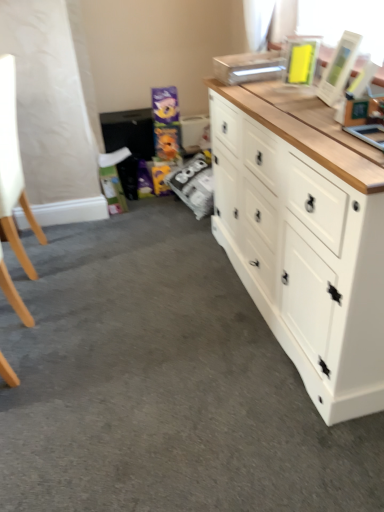
Describe the element at coordinates (304, 245) in the screenshot. The width and height of the screenshot is (384, 512). I see `white wood chest of drawers at right` at that location.

In order to face white wood chest of drawers at right, should I rotate leftwards or rightwards?

It's best to rotate right around 15.090 degrees.

Locate an element on the screen. white wood chest of drawers at right is located at coordinates (304, 245).

Describe the element at coordinates (13, 167) in the screenshot. I see `white leather swivel chair at left` at that location.

Locate an element on the screen. The image size is (384, 512). white leather swivel chair at left is located at coordinates (13, 167).

Find the location of a particular element. This screenshot has width=384, height=512. white wood chest of drawers at right is located at coordinates (304, 245).

Considering the relative positions of white wood chest of drawers at right and white leather swivel chair at left in the image provided, is white wood chest of drawers at right to the left of white leather swivel chair at left from the viewer's perspective?

Incorrect, white wood chest of drawers at right is not on the left side of white leather swivel chair at left.

Considering their positions, is white wood chest of drawers at right located in front of or behind white leather swivel chair at left?

white wood chest of drawers at right is in front of white leather swivel chair at left.

Does point (360, 234) lie behind point (10, 213)?

No, (360, 234) is closer to viewer.

From the image's perspective, between white wood chest of drawers at right and white leather swivel chair at left, which one is located above?

white leather swivel chair at left, from the image's perspective.

From a real-world perspective, is white wood chest of drawers at right above or below white leather swivel chair at left?

white wood chest of drawers at right is below white leather swivel chair at left.

Based on the photo, is white wood chest of drawers at right thinner than white leather swivel chair at left?

No, white wood chest of drawers at right is not thinner than white leather swivel chair at left.

Can you confirm if white wood chest of drawers at right is shorter than white leather swivel chair at left?

Yes.

Which of these two, white wood chest of drawers at right or white leather swivel chair at left, is smaller?

Smaller between the two is white leather swivel chair at left.

Is white wood chest of drawers at right inside the boundaries of white leather swivel chair at left, or outside?

white wood chest of drawers at right is spatially situated outside white leather swivel chair at left.

Is white wood chest of drawers at right far away from white leather swivel chair at left?

Absolutely, white wood chest of drawers at right is distant from white leather swivel chair at left.

In the scene shown: Could you tell me if white wood chest of drawers at right is facing white leather swivel chair at left?

Yes, white wood chest of drawers at right is oriented towards white leather swivel chair at left.

How many degrees apart are the facing directions of white wood chest of drawers at right and white leather swivel chair at left?

The facing directions of white wood chest of drawers at right and white leather swivel chair at left are 5.16 degrees apart.

How distant is white wood chest of drawers at right from white leather swivel chair at left?

The distance of white wood chest of drawers at right from white leather swivel chair at left is 3.78 feet.

Identify the location of swivel chair above the white wood chest of drawers at right (from the image's perspective). The image size is (384, 512). (13, 167).

Is white leather swivel chair at left at the left side of white wood chest of drawers at right?

Yes.

Does white leather swivel chair at left lie behind white wood chest of drawers at right?

Yes, white leather swivel chair at left is further from the viewer.

Does point (8, 207) lie in front of point (325, 170)?

No, it is not.

From the image's perspective, is white leather swivel chair at left beneath white wood chest of drawers at right?

Incorrect, from the image's perspective, white leather swivel chair at left is higher than white wood chest of drawers at right.

From a real-world perspective, does white leather swivel chair at left stand above white wood chest of drawers at right?

Yes, from a real-world perspective, white leather swivel chair at left is above white wood chest of drawers at right.

Is white leather swivel chair at left wider or thinner than white wood chest of drawers at right?

white leather swivel chair at left is thinner than white wood chest of drawers at right.

Which of these two, white leather swivel chair at left or white wood chest of drawers at right, stands taller?

With more height is white leather swivel chair at left.

Does white leather swivel chair at left have a smaller size compared to white wood chest of drawers at right?

Yes, white leather swivel chair at left is smaller than white wood chest of drawers at right.

Which is correct: white leather swivel chair at left is inside white wood chest of drawers at right, or outside of it?

The correct answer is: outside.

Can you see white leather swivel chair at left touching white wood chest of drawers at right?

No, white leather swivel chair at left is not beside white wood chest of drawers at right.

Is white leather swivel chair at left turned away from white wood chest of drawers at right?

Correct, white leather swivel chair at left is looking away from white wood chest of drawers at right.

How distant is white leather swivel chair at left from white wood chest of drawers at right?

white leather swivel chair at left is 3.78 feet away from white wood chest of drawers at right.

At what (x,y) coordinates should I click in order to perform the action: click on the chest of drawers that appears below the white leather swivel chair at left (from the image's perspective). Please return your answer as a coordinate pair (x, y). This screenshot has width=384, height=512. Looking at the image, I should click on (304, 245).

The height and width of the screenshot is (512, 384). Identify the location of the chest of drawers located below the white leather swivel chair at left (from the image's perspective). (304, 245).

Identify the location of swivel chair located behind the white wood chest of drawers at right. This screenshot has width=384, height=512. (13, 167).